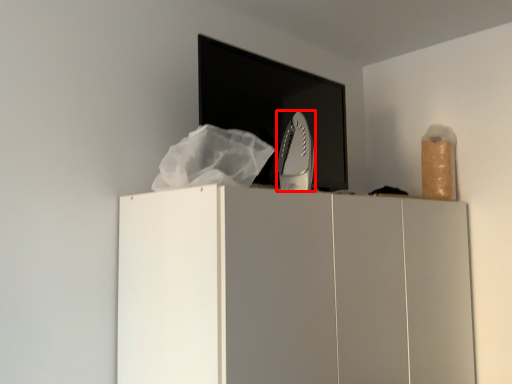
Question: Where is home appliance (annotated by the red box) located in relation to cupboard in the image?

Choices:
 (A) left
 (B) right

Answer: (A)